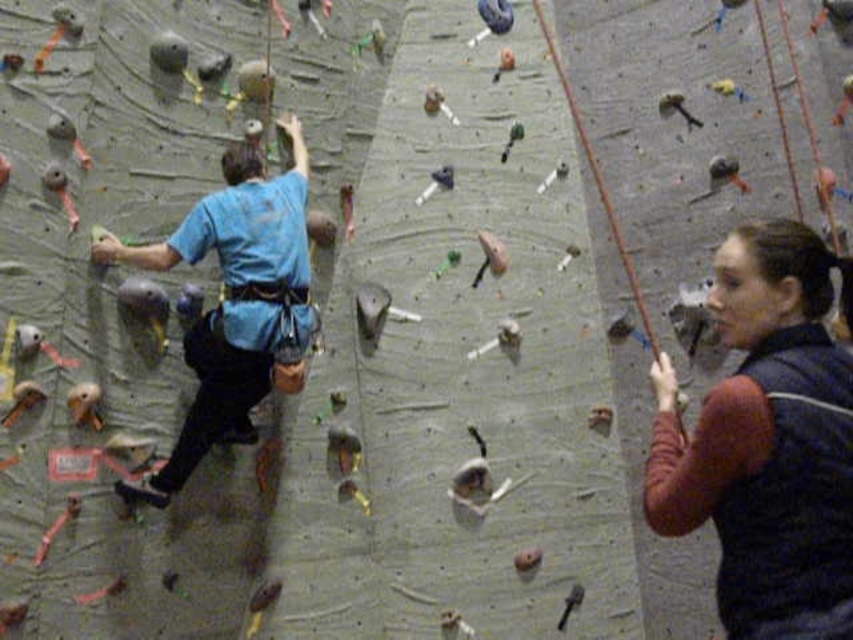
You are a photographer positioned in front of the climbing wall. You want to take a photo that includes both the dark blue fleece vest at right and the blue fabric shirt at center. Which object should you focus on first to ensure both are in sharp focus?

You should focus on the dark blue fleece vest at right first because it is closer to the viewer than the blue fabric shirt at center. By focusing on the closer object, the farther one will still be in focus due to the depth of field.

You are a photographer trying to capture the climber and the observer in a single shot. Since your camera has a limited field of view, you need to adjust your position so that both the dark blue fleece vest at right and the blue fabric shirt at center are fully visible. Based on their positions, which direction should you move relative to the climbing wall to ensure both are in frame?

You should move to the left relative to the climbing wall so that both the dark blue fleece vest at right and the blue fabric shirt at center are fully visible. Since the dark blue fleece vest at right is to the right of the blue fabric shirt at center, moving left will widen your field of view to include both objects.

You are organizing a clothing donation drive and need to determine which items take up more space in storage. Based on the image, which item is larger in size between the dark blue fleece vest at right and the blue fabric shirt at center?

The dark blue fleece vest at right occupies less space than the blue fabric shirt at center, so the blue fabric shirt at center is larger in size.